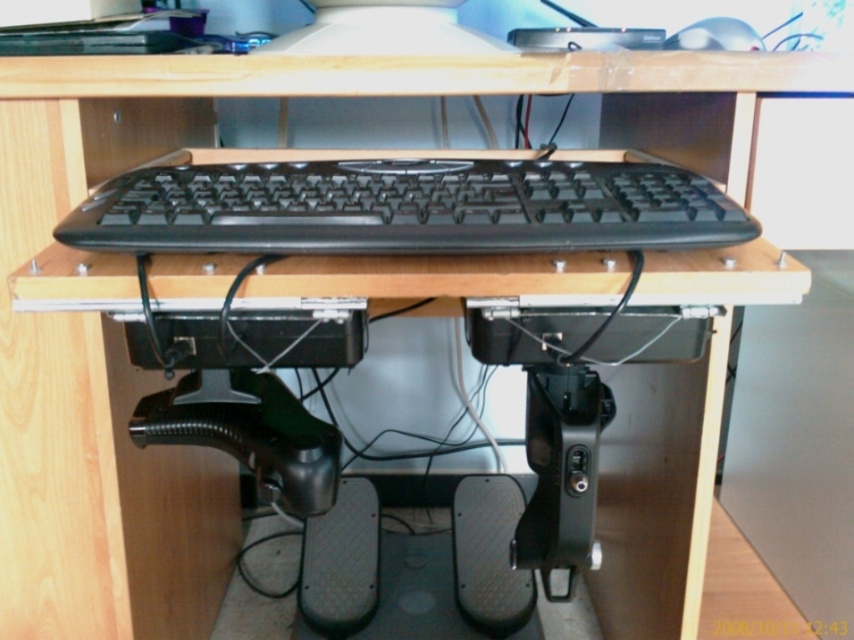
What are the coordinates of `black matte keyboard at center` in the screenshot? It's located at (407, 209).

Describe the element at coordinates (407, 209) in the screenshot. This screenshot has height=640, width=854. I see `black matte keyboard at center` at that location.

Is black matte keyboard at center thinner than matte black monitor at upper center?

No, black matte keyboard at center is not thinner than matte black monitor at upper center.

Who is more forward, (389,160) or (363,26)?

Point (363,26)

I want to click on black matte keyboard at center, so click(x=407, y=209).

Does matte black monitor at upper center have a smaller size compared to silver metallic mouse at upper right?

No.

Can you confirm if matte black monitor at upper center is bigger than silver metallic mouse at upper right?

Correct, matte black monitor at upper center is larger in size than silver metallic mouse at upper right.

Locate an element on the screen. matte black monitor at upper center is located at coordinates (384, 29).